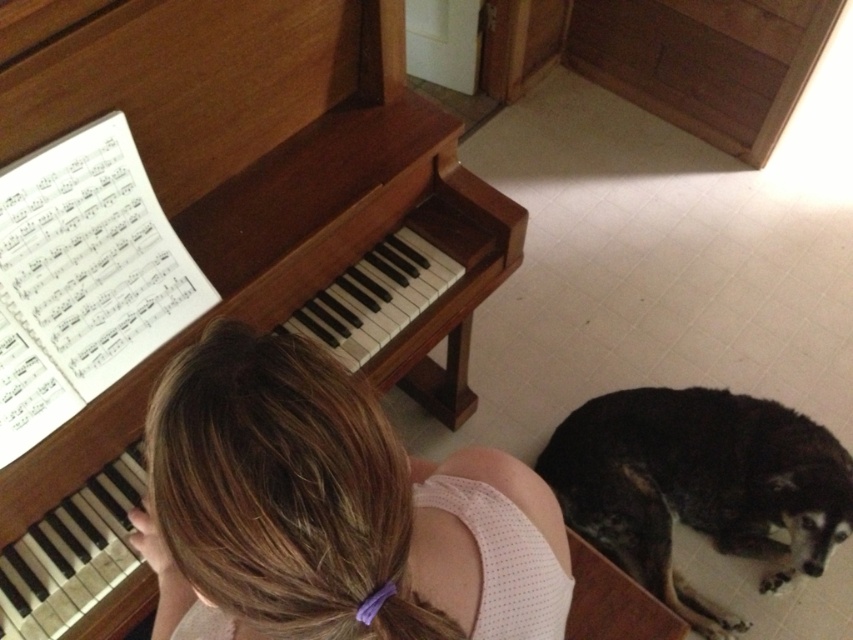
You are standing in the room and want to see both the wooden piano at left and the black fur dog at lower right clearly. Which object should you look at first if you want to see them both without moving your head?

You should look at the wooden piano at left first because it is closer to you, so you can see it without moving your head, and then you can see the black fur dog at lower right behind it.

You are standing in front of the piano and want to reach the point at coordinates (x=39, y=513). Considering the distance, can you comfortably reach it without moving your position?

The point at coordinates (x=39, y=513) is 3.82 feet away from the camera. Since this distance is within a typical comfortable reaching range for most people, you can likely reach it without moving your position.